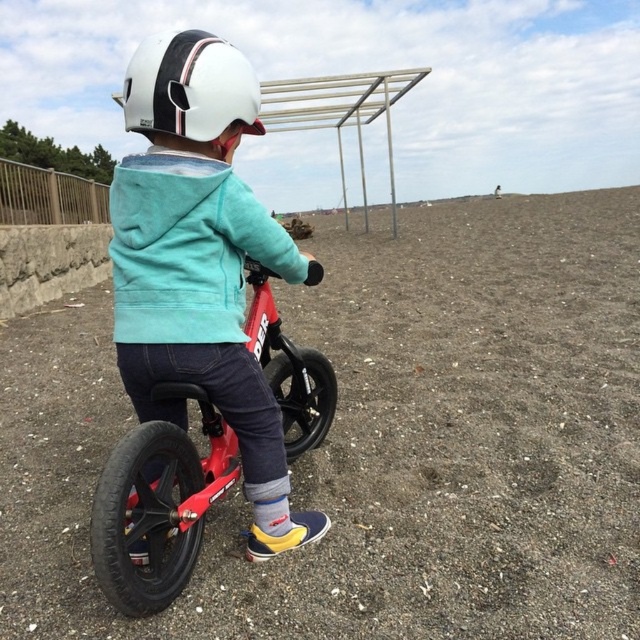
You are a photographer trying to capture the child riding the balance bike. You need to decide whether to focus on the dull brown dirt at center or the white matte helmet at upper center. Which object is wider in the image?

The dull brown dirt at center might be wider than white matte helmet at upper center, so the photographer should focus on the dull brown dirt at center as it is wider.